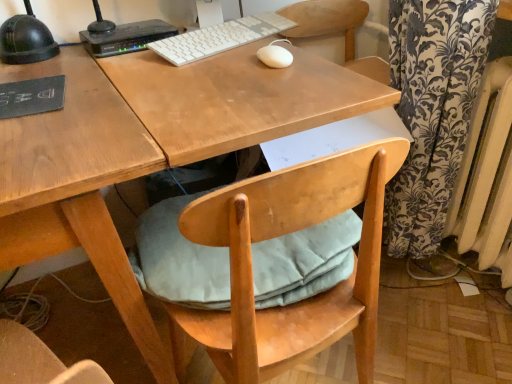
Locate an element on the screen. The width and height of the screenshot is (512, 384). vacant area that is in front of white matte mouse at center is located at coordinates (274, 84).